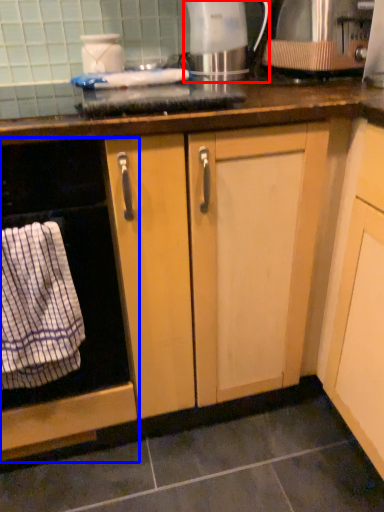
Question: Which point is closer to the camera, kitchen appliance (highlighted by a red box) or home appliance (highlighted by a blue box)?

Choices:
 (A) kitchen appliance
 (B) home appliance

Answer: (B)